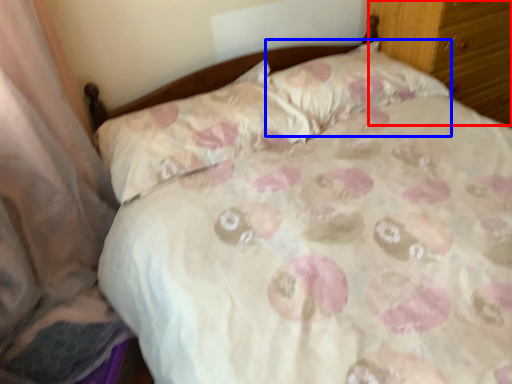
Question: Which object is closer to the camera taking this photo, dresser (highlighted by a red box) or pillow (highlighted by a blue box)?

Choices:
 (A) dresser
 (B) pillow

Answer: (B)